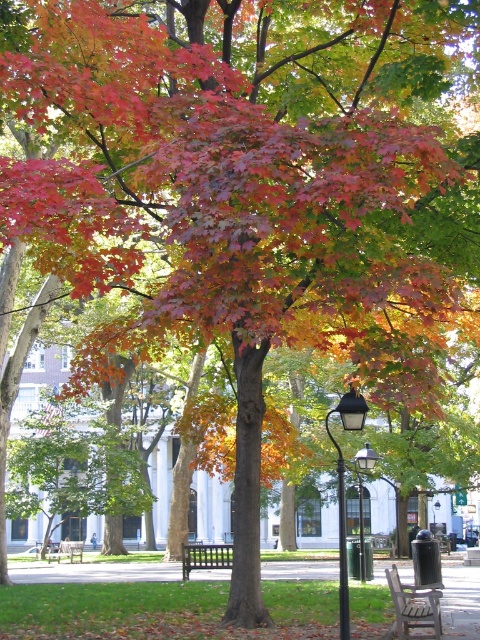
Between black wooden bench at center and wooden bench at center, which one is positioned lower?

wooden bench at center is below.

Who is higher up, black wooden bench at center or wooden bench at center?

black wooden bench at center is above.

The image size is (480, 640). Find the location of `black wooden bench at center`. black wooden bench at center is located at coordinates (205, 556).

Can you confirm if black metal streetlight at lower right is smaller than wooden bench at lower right?

No.

Who is taller, black metal streetlight at lower right or wooden bench at lower right?

With more height is black metal streetlight at lower right.

Where is `black metal streetlight at lower right`? The image size is (480, 640). black metal streetlight at lower right is located at coordinates (344, 490).

Describe the element at coordinates (344, 490) in the screenshot. This screenshot has width=480, height=640. I see `black metal streetlight at lower right` at that location.

Between black metal streetlight at lower right and black wooden bench at center, which one appears on the right side from the viewer's perspective?

black metal streetlight at lower right is more to the right.

Is point (339, 532) farther from camera compared to point (182, 552)?

No, (339, 532) is in front of (182, 552).

This screenshot has width=480, height=640. Identify the location of black metal streetlight at lower right. (344, 490).